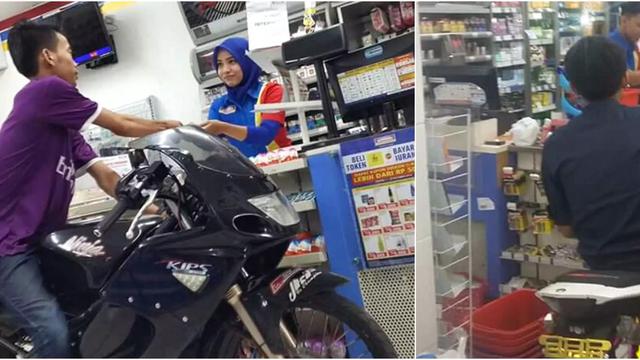
You are a GUI agent. You are given a task and a screenshot of the screen. Output one action in this format:
    pyautogui.click(x=<x>, y=<y>)
    Task: Click on the tv screen
    Image resolution: width=640 pixels, height=360 pixels.
    Given the screenshot: What is the action you would take?
    pyautogui.click(x=83, y=35)